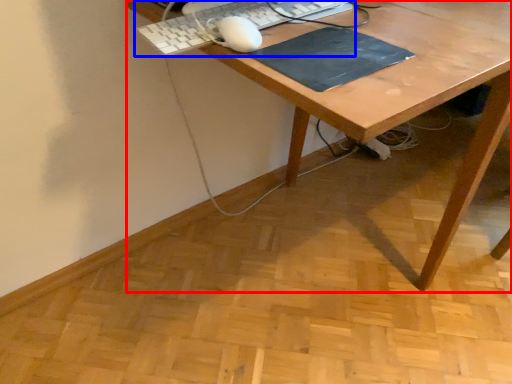
Question: Which point is closer to the camera, desk (highlighted by a red box) or computer keyboard (highlighted by a blue box)?

Choices:
 (A) desk
 (B) computer keyboard

Answer: (A)